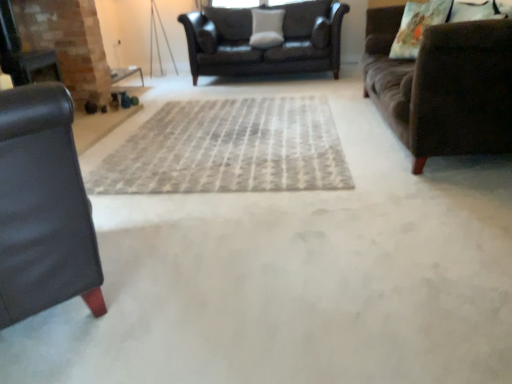
At what (x,y) coordinates should I click in order to perform the action: click on vacant space in between black leather couch at left, which ranks as the first studio couch in front-to-back order, and dark brown leather couch at center, the 1th studio couch from the back. Please return your answer as a coordinate pair (x, y). Looking at the image, I should click on (205, 146).